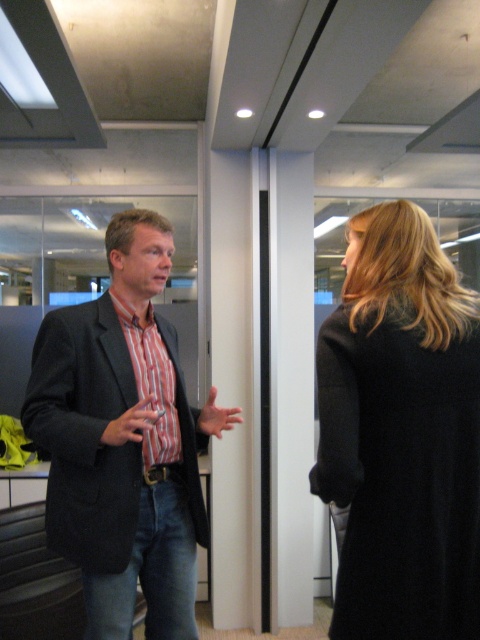
Question: Does black wool coat at right have a greater width compared to striped cotton shirt at center?

Choices:
 (A) yes
 (B) no

Answer: (B)

Question: Where is black wool coat at right located in relation to striped cotton shirt at center in the image?

Choices:
 (A) below
 (B) above

Answer: (B)

Question: Which object is farther from the camera taking this photo?

Choices:
 (A) black wool coat at right
 (B) striped cotton shirt at center

Answer: (B)

Question: Is black wool coat at right positioned at the back of striped cotton shirt at center?

Choices:
 (A) no
 (B) yes

Answer: (A)

Question: Which point is closer to the camera?

Choices:
 (A) (428, 512)
 (B) (172, 492)

Answer: (A)